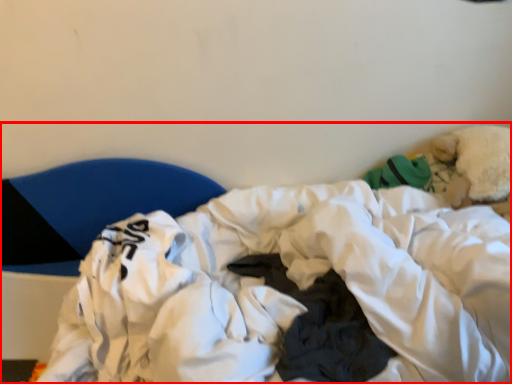
Question: Observing the image, what is the correct spatial positioning of hospital bed (annotated by the red box) in reference to furniture?

Choices:
 (A) right
 (B) left

Answer: (A)